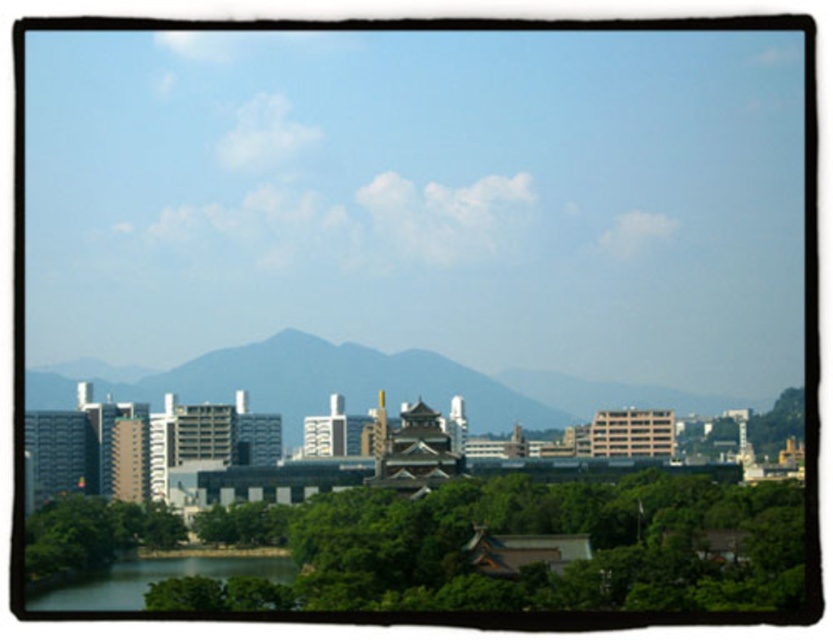
Question: Which object appears closest to the camera in this image?

Choices:
 (A) green smooth water at lower left
 (B) green leafy trees at lower center
 (C) gray/smooth mountain at center

Answer: (C)

Question: Which point appears closest to the camera in this image?

Choices:
 (A) (225, 372)
 (B) (222, 577)

Answer: (A)

Question: Is the position of green leafy trees at lower center more distant than that of green smooth water at lower left?

Choices:
 (A) no
 (B) yes

Answer: (A)

Question: Which point is closer to the camera taking this photo?

Choices:
 (A) pos(318,541)
 (B) pos(469,394)

Answer: (B)

Question: Is gray/smooth mountain at center above green smooth water at lower left?

Choices:
 (A) yes
 (B) no

Answer: (A)

Question: Is green leafy trees at lower center positioned at the back of gray/smooth mountain at center?

Choices:
 (A) no
 (B) yes

Answer: (B)